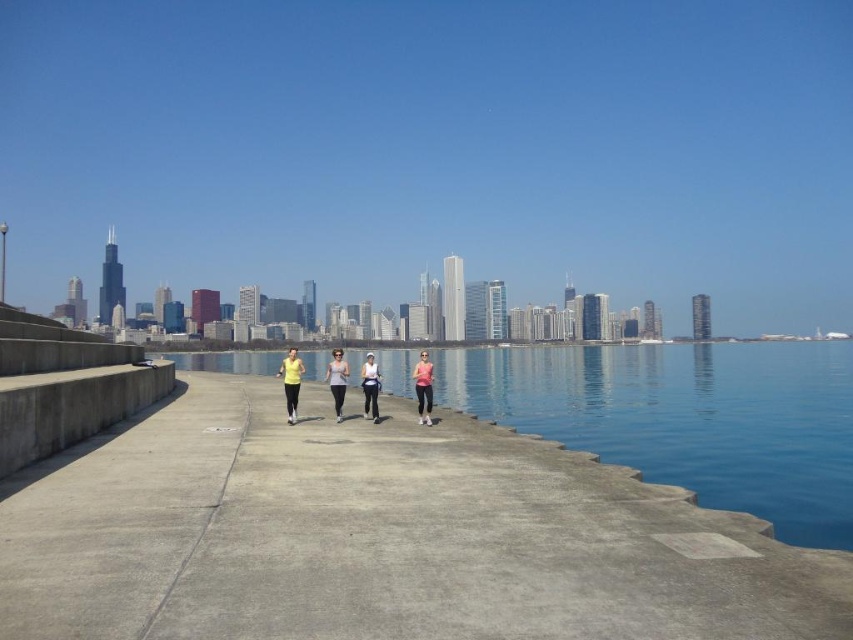
Can you confirm if blue water at center is bigger than matte white tank top at center?

Yes.

Consider the image. Who is positioned more to the left, blue water at center or matte white tank top at center?

matte white tank top at center

Which is in front, point (544, 371) or point (340, 378)?

Positioned in front is point (340, 378).

Locate an element on the screen. This screenshot has height=640, width=853. blue water at center is located at coordinates (688, 419).

Is matte yellow shirt at center above white matte tank top at center?

Yes.

Is point (297, 387) more distant than point (376, 384)?

That is False.

At what (x,y) coordinates should I click in order to perform the action: click on matte yellow shirt at center. Please return your answer as a coordinate pair (x, y). The height and width of the screenshot is (640, 853). Looking at the image, I should click on (291, 381).

Who is higher up, blue water at center or matte yellow tank top at center?

Positioned higher is matte yellow tank top at center.

Which of these two, blue water at center or matte yellow tank top at center, stands shorter?

matte yellow tank top at center

You are a GUI agent. You are given a task and a screenshot of the screen. Output one action in this format:
    pyautogui.click(x=<x>, y=<y>)
    Task: Click on the blue water at center
    The image size is (853, 640).
    Given the screenshot: What is the action you would take?
    pyautogui.click(x=688, y=419)